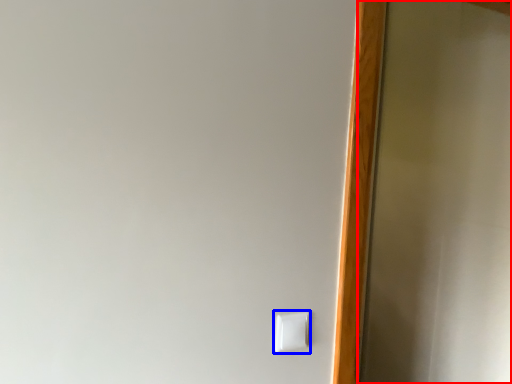
Question: Among these objects, which one is farthest to the camera, screen door (highlighted by a red box) or light switch (highlighted by a blue box)?

Choices:
 (A) screen door
 (B) light switch

Answer: (A)